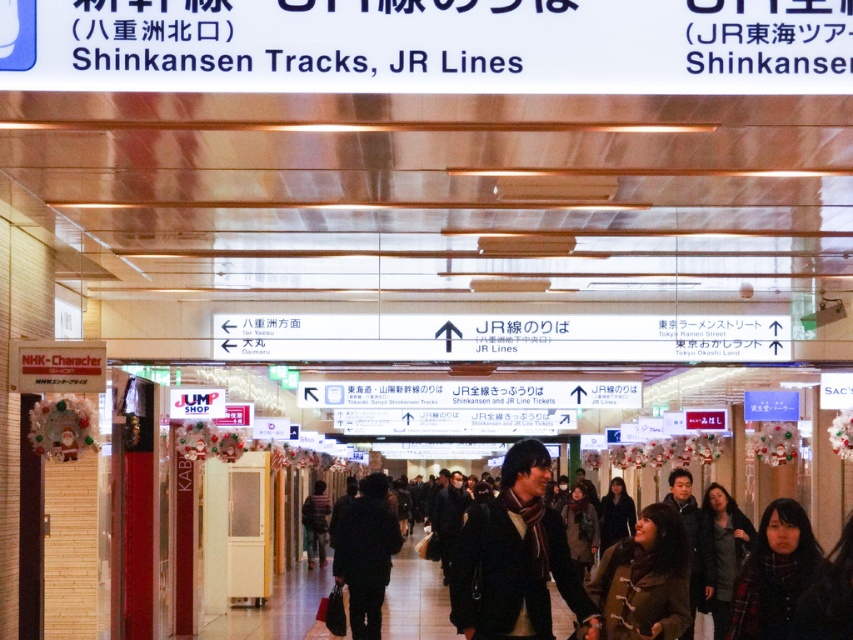
Question: Where is dark brown scarf at center located in relation to plaid scarf at center in the image?

Choices:
 (A) right
 (B) left

Answer: (B)

Question: Is brown leather jacket at lower right to the right of plaid scarf at center from the viewer's perspective?

Choices:
 (A) no
 (B) yes

Answer: (A)

Question: Which of these objects is positioned closest to the dark gray fabric jacket at center?

Choices:
 (A) dark brown scarf at center
 (B) brown leather jacket at lower right

Answer: (B)

Question: Observing the image, what is the correct spatial positioning of brown leather jacket at lower right in reference to dark gray wool coat at lower right?

Choices:
 (A) left
 (B) right

Answer: (A)

Question: Which object appears closest to the camera in this image?

Choices:
 (A) striped sweater at center
 (B) dark brown leather coat at center
 (C) brown leather jacket at lower right

Answer: (C)

Question: Which is farther from the striped sweater at center?

Choices:
 (A) dark gray fabric jacket at center
 (B) brown leather jacket at lower right
 (C) dark gray wool coat at lower right
 (D) dark brown scarf at center

Answer: (D)